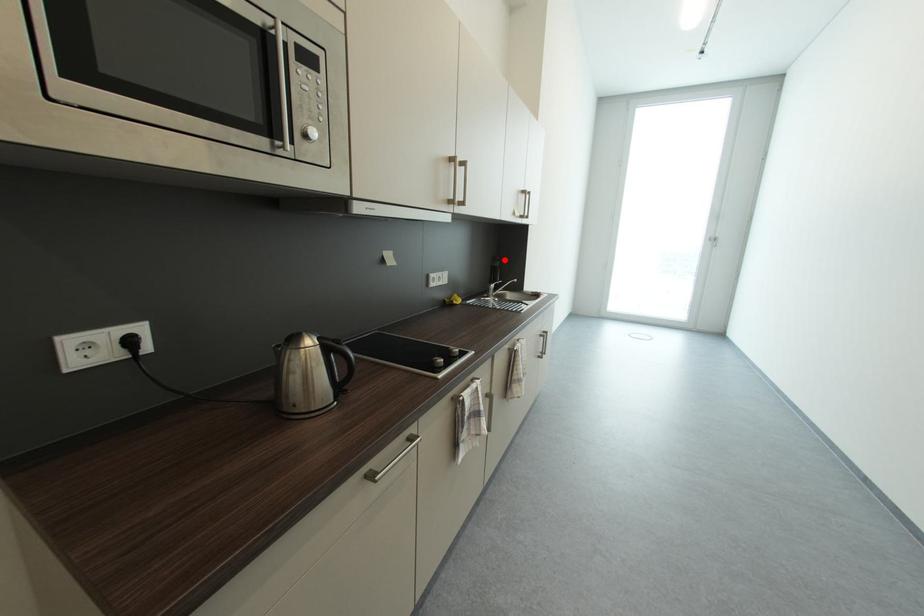
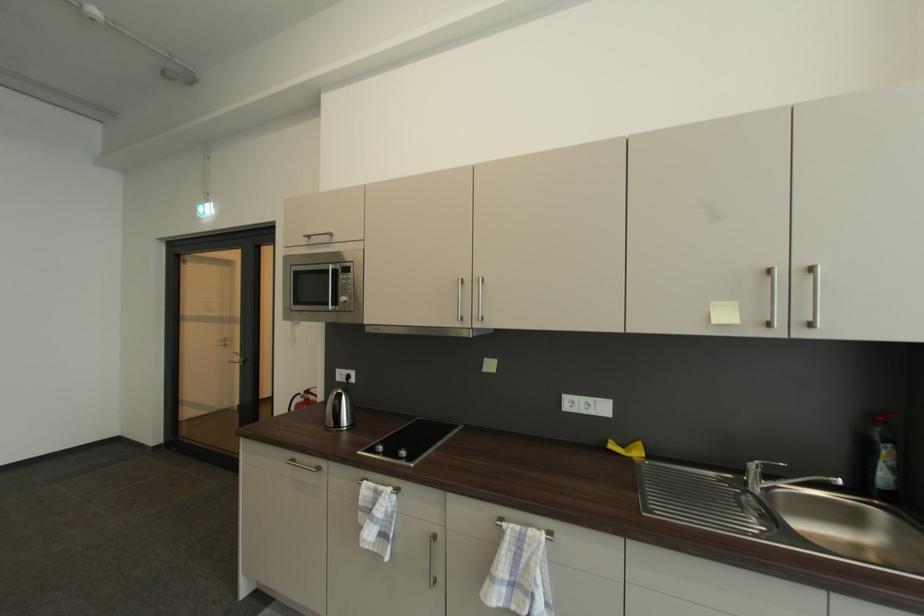
Question: I am providing you with two images of the same scene from different viewpoints. In image1, a red point is highlighted. Considering the same 3D point in image2, which of the following is correct?

Choices:
 (A) It is closer
 (B) It is farther

Answer: (B)